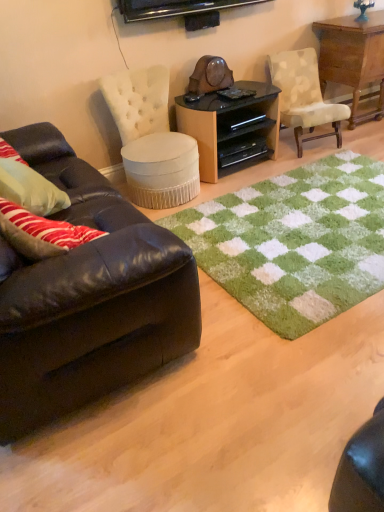
Question: Can you confirm if black plastic drawer at center, which is the 2th drawer in bottom-to-top order, is smaller than shiny brown leather couch at left?

Choices:
 (A) yes
 (B) no

Answer: (A)

Question: Considering the relative sizes of black plastic drawer at center, which is the 2th drawer in bottom-to-top order, and shiny brown leather couch at left in the image provided, is black plastic drawer at center, which is the 2th drawer in bottom-to-top order, bigger than shiny brown leather couch at left?

Choices:
 (A) no
 (B) yes

Answer: (A)

Question: Does black plastic drawer at center, which is the 2th drawer in bottom-to-top order, have a lesser height compared to shiny brown leather couch at left?

Choices:
 (A) yes
 (B) no

Answer: (A)

Question: Is black plastic drawer at center, which is the 1th drawer from top to bottom, at the left side of shiny brown leather couch at left?

Choices:
 (A) no
 (B) yes

Answer: (A)

Question: Is black plastic drawer at center, which is the 2th drawer in bottom-to-top order, in front of shiny brown leather couch at left?

Choices:
 (A) no
 (B) yes

Answer: (A)

Question: Considering the positions of shiny brown leather couch at left and wooden table at upper right in the image, is shiny brown leather couch at left taller or shorter than wooden table at upper right?

Choices:
 (A) short
 (B) tall

Answer: (B)

Question: Based on their sizes in the image, would you say shiny brown leather couch at left is bigger or smaller than wooden table at upper right?

Choices:
 (A) big
 (B) small

Answer: (A)

Question: Considering their positions, is shiny brown leather couch at left located in front of or behind wooden table at upper right?

Choices:
 (A) front
 (B) behind

Answer: (A)

Question: Looking at their shapes, would you say shiny brown leather couch at left is wider or thinner than wooden table at upper right?

Choices:
 (A) thin
 (B) wide

Answer: (B)

Question: Considering the relative positions of green shaggy rug at center and wooden table at upper right in the image provided, is green shaggy rug at center to the left or to the right of wooden table at upper right?

Choices:
 (A) left
 (B) right

Answer: (A)

Question: Considering the positions of green shaggy rug at center and wooden table at upper right in the image, is green shaggy rug at center wider or thinner than wooden table at upper right?

Choices:
 (A) thin
 (B) wide

Answer: (B)

Question: Relative to wooden table at upper right, is green shaggy rug at center in front or behind?

Choices:
 (A) front
 (B) behind

Answer: (A)

Question: Is point (307, 251) positioned closer to the camera than point (349, 19)?

Choices:
 (A) farther
 (B) closer

Answer: (B)

Question: In terms of width, does black glossy wood desk at center look wider or thinner when compared to black plastic drawer at center, which is the 1th drawer from top to bottom?

Choices:
 (A) wide
 (B) thin

Answer: (A)

Question: Would you say black glossy wood desk at center is to the left or to the right of black plastic drawer at center, which is the 2th drawer in bottom-to-top order, in the picture?

Choices:
 (A) left
 (B) right

Answer: (A)